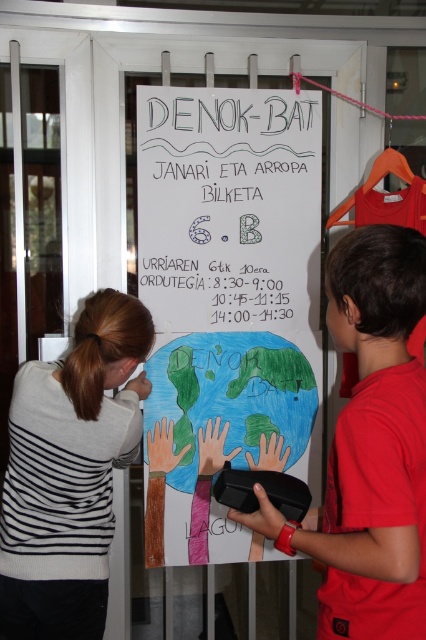
Question: Does white paper at center have a larger size compared to black paper at center?

Choices:
 (A) yes
 (B) no

Answer: (A)

Question: Which point is farther from the camera taking this photo?

Choices:
 (A) (28, 637)
 (B) (161, 259)
 (C) (267, 312)

Answer: (C)

Question: Based on their relative distances, which object is farther from the black paper at center?

Choices:
 (A) striped sweater at left
 (B) red matte shirt at right

Answer: (B)

Question: Is red matte shirt at right to the left of black paper at center from the viewer's perspective?

Choices:
 (A) no
 (B) yes

Answer: (A)

Question: Which object is farther from the camera taking this photo?

Choices:
 (A) striped sweater at left
 (B) white paper at center
 (C) red matte shirt at right

Answer: (B)

Question: Where is red matte shirt at right located in relation to striped sweater at left in the image?

Choices:
 (A) left
 (B) right

Answer: (B)